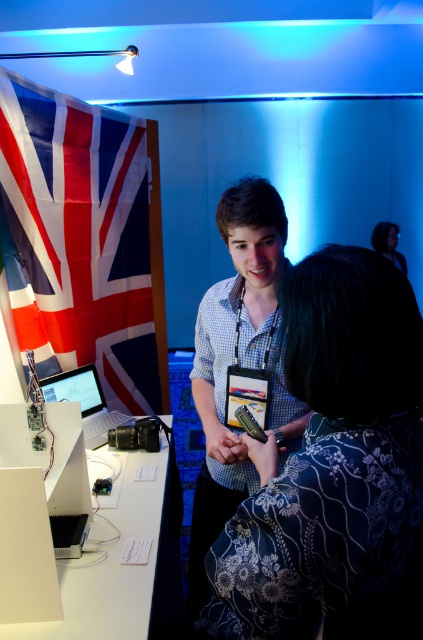
Is white plastic computer at lower left taller than black leather jacket at upper right?

No, white plastic computer at lower left is not taller than black leather jacket at upper right.

Which is more to the right, white plastic computer at lower left or black leather jacket at upper right?

From the viewer's perspective, black leather jacket at upper right appears more on the right side.

What do you see at coordinates (54, 468) in the screenshot? I see `white plastic computer at lower left` at bounding box center [54, 468].

You are a GUI agent. You are given a task and a screenshot of the screen. Output one action in this format:
    pyautogui.click(x=<x>, y=<y>)
    Task: Click on the white plastic computer at lower left
    
    Given the screenshot: What is the action you would take?
    pyautogui.click(x=54, y=468)

From the picture: Is floral fabric dress at center shorter than black leather jacket at upper right?

Incorrect, floral fabric dress at center's height does not fall short of black leather jacket at upper right's.

Is point (296, 284) behind point (387, 227)?

That is False.

Is point (378, 444) positioned behind point (381, 244)?

No, (378, 444) is in front of (381, 244).

Locate an element on the screen. The width and height of the screenshot is (423, 640). floral fabric dress at center is located at coordinates (335, 468).

Which is above, red and white fabric flag at left or checkered fabric shirt at center?

Positioned higher is red and white fabric flag at left.

Which of these two, red and white fabric flag at left or checkered fabric shirt at center, stands taller?

Standing taller between the two is red and white fabric flag at left.

Is point (110, 204) positioned behind point (227, 244)?

Yes, point (110, 204) is farther from viewer.

Where is `red and white fabric flag at left`? The image size is (423, 640). red and white fabric flag at left is located at coordinates (85, 240).